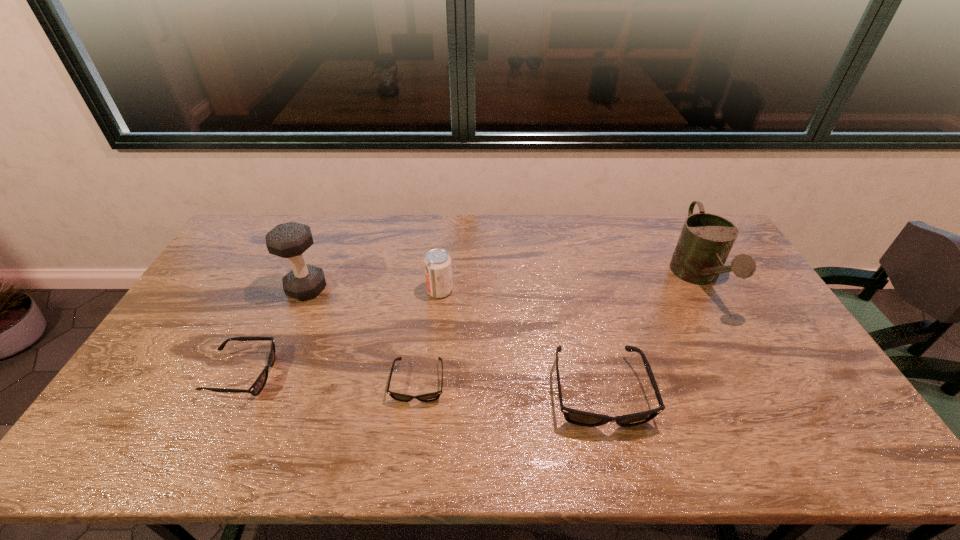
The width and height of the screenshot is (960, 540). I want to click on vacant space at the near left corner, so click(x=170, y=393).

The width and height of the screenshot is (960, 540). Find the location of `vacant area at the near right corner`. vacant area at the near right corner is located at coordinates (813, 413).

In order to click on empty space between the dumbbell and the shortest sunglasses in this screenshot , I will do `click(362, 335)`.

Locate an element on the screen. This screenshot has width=960, height=540. free space between the third shortest object and the second sunglasses from right to left is located at coordinates (509, 387).

The image size is (960, 540). Find the location of `empty space between the third shortest object and the dumbbell`. empty space between the third shortest object and the dumbbell is located at coordinates (453, 340).

Find the location of a particular element. vacant area that lies between the watering can and the third tallest object is located at coordinates (569, 284).

Where is `vacant space in between the second shortest sunglasses and the soda can`? vacant space in between the second shortest sunglasses and the soda can is located at coordinates (342, 333).

You are a GUI agent. You are given a task and a screenshot of the screen. Output one action in this format:
    pyautogui.click(x=<x>, y=<y>)
    Task: Click on the vacant area that lies between the shortest object and the second shortest sunglasses
    This screenshot has height=540, width=960.
    Given the screenshot: What is the action you would take?
    pyautogui.click(x=330, y=379)

This screenshot has width=960, height=540. In order to click on unoccupied area between the third shortest object and the third tallest object in this screenshot , I will do `click(519, 341)`.

Image resolution: width=960 pixels, height=540 pixels. Find the location of `free point between the second object from right to left and the leftmost sunglasses`. free point between the second object from right to left and the leftmost sunglasses is located at coordinates (421, 383).